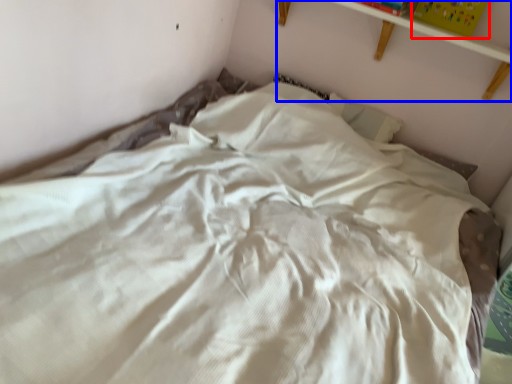
Question: Among these objects, which one is farthest to the camera, paperback book (highlighted by a red box) or shelf (highlighted by a blue box)?

Choices:
 (A) paperback book
 (B) shelf

Answer: (A)